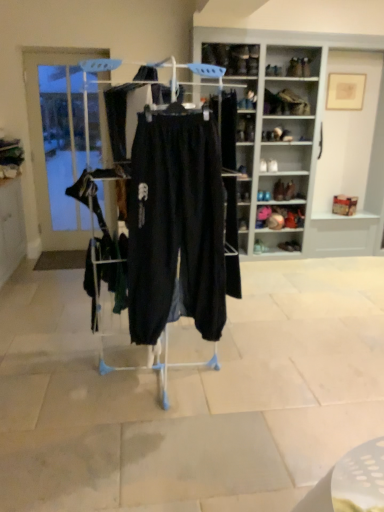
Question: In terms of size, does matte black shoe at center, which is counted as the 4th footwear, starting from the right, appear bigger or smaller than matte black shoe at center, the first footwear from the top?

Choices:
 (A) small
 (B) big

Answer: (A)

Question: Looking at their shapes, would you say matte black shoe at center, the 4th footwear viewed from the top, is wider or thinner than matte black shoe at center, the first footwear from the top?

Choices:
 (A) thin
 (B) wide

Answer: (A)

Question: Which object is positioned farthest from the matte black shoe at center, positioned as the first footwear in left-to-right order?

Choices:
 (A) white wood shelves at upper right, the 2th shelf positioned from the bottom
 (B) matte black shoe at center, the 2th footwear when ordered from top to bottom
 (C) white glossy tile at lower right
 (D) matte black shoe at center, which ranks as the 1th shelf in left-to-right order
 (E) matte black shoe at center, which is the 1th footwear from right to left

Answer: (C)

Question: Which is nearer to the matte black shoe at center, the 3th footwear from the left?

Choices:
 (A) clear glass door at left
 (B) white glossy tile at lower right
 (C) black cotton pants at center
 (D) matte black shoe at center, which ranks as the 1th shelf in left-to-right order
 (E) matte black shoe at center, the 2th footwear when ordered from top to bottom

Answer: (E)